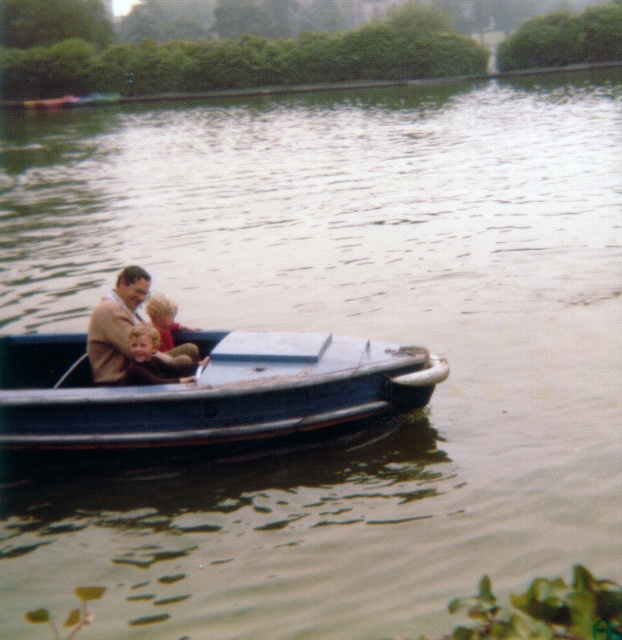
Based on the photo, you are a delivery drone that needs to drop a package into the blue metallic boat at center. The drone has a delivery arm that can extend 24 inches. Can the drone reach the brown woolen suit at center from the boat?

The blue metallic boat at center and brown woolen suit at center are 24.37 inches apart. The delivery arm can only extend 24 inches, so it cannot reach the brown woolen suit at center from the boat.

You are standing on the dock and see the blue metallic boat at center and the brown woolen suit at center in the image. Which object is positioned further to the right?

The blue metallic boat at center is positioned to the right of the brown woolen suit at center, so it is further to the right.